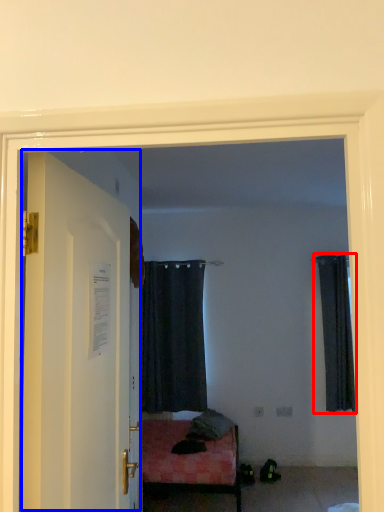
Question: Which object is closer to the camera taking this photo, curtain (highlighted by a red box) or door (highlighted by a blue box)?

Choices:
 (A) curtain
 (B) door

Answer: (B)